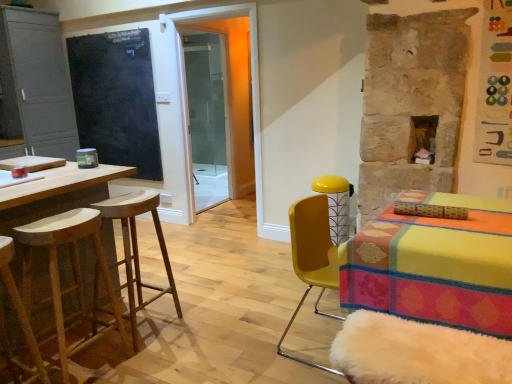
Find the location of a particular element. The height and width of the screenshot is (384, 512). vacant area that lies between wooden bar stool at left, arranged as the 1th stool when viewed from the back, and yellow matte chair at right is located at coordinates (230, 336).